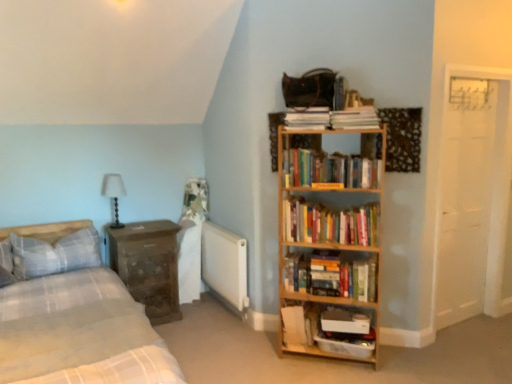
Question: From the image's perspective, is wooden bookshelf at upper right, which ranks as the 1th book in top-to-bottom order, on hardcover books at center right, the 2th book from the top?

Choices:
 (A) yes
 (B) no

Answer: (A)

Question: From a real-world perspective, is wooden bookshelf at upper right, marked as the 3th book in a bottom-to-top arrangement, over hardcover books at center right, the 2th book from the top?

Choices:
 (A) no
 (B) yes

Answer: (B)

Question: Is the position of wooden bookshelf at upper right, which ranks as the 1th book in top-to-bottom order, more distant than that of hardcover books at center right, the 2th book from the top?

Choices:
 (A) no
 (B) yes

Answer: (A)

Question: From the image's perspective, is wooden bookshelf at upper right, marked as the 3th book in a bottom-to-top arrangement, beneath hardcover books at center right, marked as the 2th book in a bottom-to-top arrangement?

Choices:
 (A) no
 (B) yes

Answer: (A)

Question: Could you tell me if wooden bookshelf at upper right, marked as the 3th book in a bottom-to-top arrangement, is turned towards hardcover books at center right, marked as the 2th book in a bottom-to-top arrangement?

Choices:
 (A) no
 (B) yes

Answer: (A)

Question: Does wooden bookshelf at upper right, marked as the 3th book in a bottom-to-top arrangement, have a smaller size compared to hardcover books at center right, marked as the 2th book in a bottom-to-top arrangement?

Choices:
 (A) no
 (B) yes

Answer: (B)

Question: Is wooden bookshelf at upper right, which ranks as the 1th book in top-to-bottom order, shorter than hardcover books at center, which ranks as the first book in bottom-to-top order?

Choices:
 (A) yes
 (B) no

Answer: (A)

Question: Is the position of wooden bookshelf at upper right, which ranks as the 1th book in top-to-bottom order, more distant than that of hardcover books at center, which ranks as the first book in bottom-to-top order?

Choices:
 (A) no
 (B) yes

Answer: (A)

Question: Does wooden bookshelf at upper right, which ranks as the 1th book in top-to-bottom order, have a greater height compared to hardcover books at center, which ranks as the first book in bottom-to-top order?

Choices:
 (A) yes
 (B) no

Answer: (B)

Question: Can you confirm if wooden bookshelf at upper right, which ranks as the 1th book in top-to-bottom order, is smaller than hardcover books at center, which ranks as the first book in bottom-to-top order?

Choices:
 (A) no
 (B) yes

Answer: (B)

Question: Is wooden bookshelf at upper right, marked as the 3th book in a bottom-to-top arrangement, placed right next to hardcover books at center, marked as the third book in a top-to-bottom arrangement?

Choices:
 (A) no
 (B) yes

Answer: (A)

Question: From the image's perspective, would you say wooden bookshelf at upper right, marked as the 3th book in a bottom-to-top arrangement, is shown under hardcover books at center, which ranks as the first book in bottom-to-top order?

Choices:
 (A) yes
 (B) no

Answer: (B)

Question: Does white plastic container at lower center, the 1th shelf in the bottom-to-top sequence, contain white matte radiator at center?

Choices:
 (A) yes
 (B) no

Answer: (B)